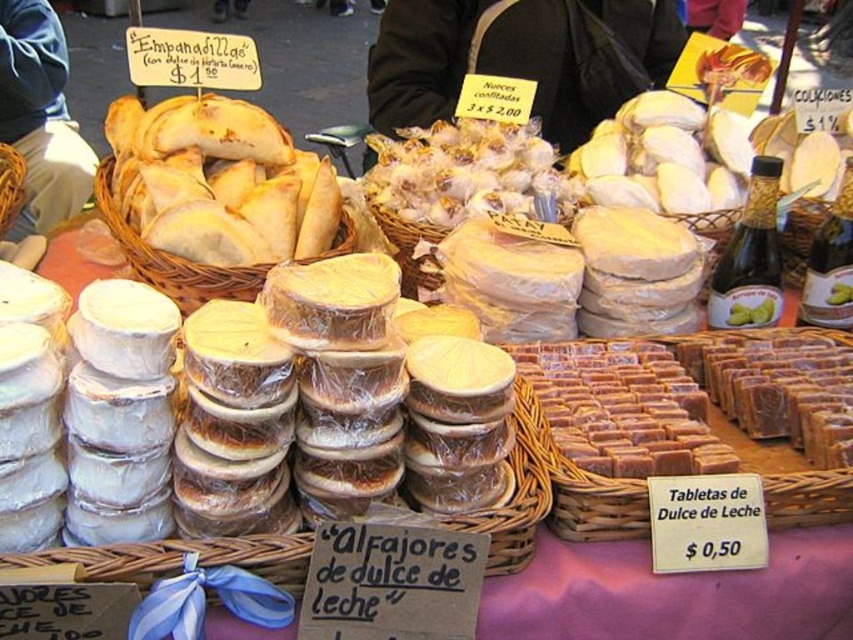
Question: Does purple fabric at lower center come behind brown wicker basket at center?

Choices:
 (A) yes
 (B) no

Answer: (B)

Question: Can you confirm if brown woven basket at center is positioned above white plastic containers at center?

Choices:
 (A) no
 (B) yes

Answer: (B)

Question: Which point is farther from the camera taking this photo?

Choices:
 (A) (598, 413)
 (B) (485, 198)
 (C) (457, 524)
 (D) (15, 195)

Answer: (D)

Question: Which point appears closest to the camera in this image?

Choices:
 (A) (102, 572)
 (B) (428, 172)
 (C) (579, 353)

Answer: (A)

Question: Estimate the real-world distances between objects in this image. Which object is closer to the brown wicker basket at center?

Choices:
 (A) translucent plastic garlic at center
 (B) purple fabric at lower center
 (C) woven brown basket at left
 (D) white plastic containers at center

Answer: (A)

Question: Does brown woven basket at center appear over white plastic containers at center?

Choices:
 (A) yes
 (B) no

Answer: (A)